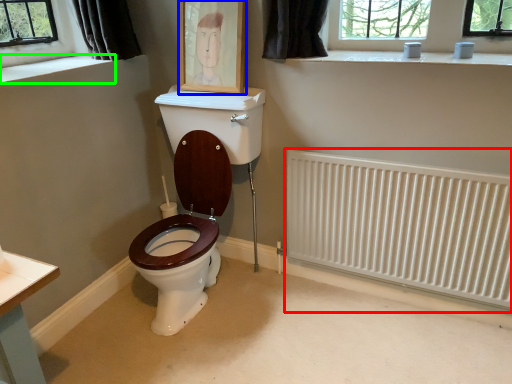
Question: Estimate the real-world distances between objects in this image. Which object is farther from radiator (highlighted by a red box), picture frame (highlighted by a blue box) or window sill (highlighted by a green box)?

Choices:
 (A) picture frame
 (B) window sill

Answer: (B)